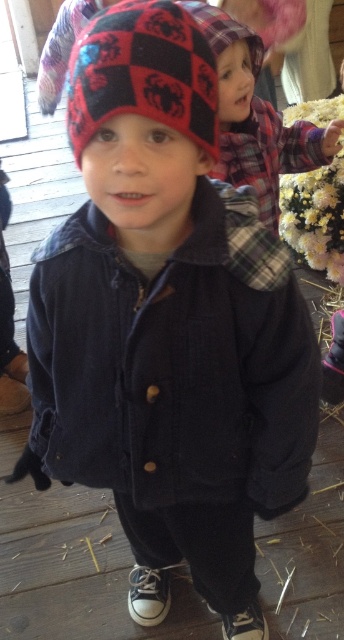
Question: Which of the following is the farthest from the observer?

Choices:
 (A) (217, 419)
 (B) (304, 156)
 (C) (68, 88)

Answer: (B)

Question: Can you confirm if red checkered knit beanie at upper left is bigger than plaid fabric child at upper center?

Choices:
 (A) no
 (B) yes

Answer: (A)

Question: Observing the image, what is the correct spatial positioning of red checkered knit beanie at upper left in reference to plaid fabric child at upper center?

Choices:
 (A) left
 (B) right

Answer: (A)

Question: Among these points, which one is farthest from the camera?

Choices:
 (A) pyautogui.click(x=149, y=80)
 (B) pyautogui.click(x=234, y=164)
 (C) pyautogui.click(x=67, y=285)

Answer: (B)

Question: Estimate the real-world distances between objects in this image. Which object is closer to the navy corduroy jacket at center?

Choices:
 (A) plaid fabric child at upper center
 (B) red checkered knit beanie at upper left

Answer: (B)

Question: Can you confirm if navy corduroy jacket at center is thinner than red checkered knit beanie at upper left?

Choices:
 (A) no
 (B) yes

Answer: (A)